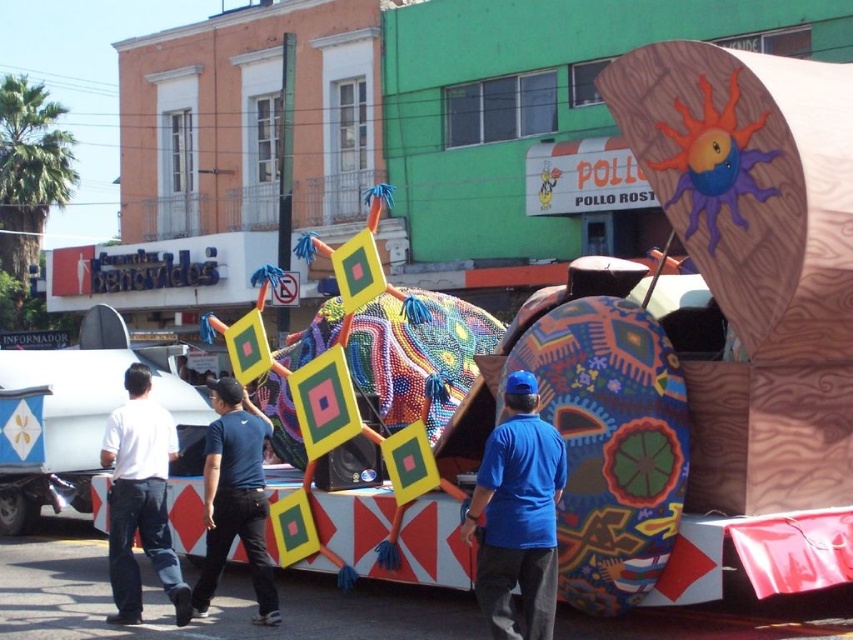
You are standing in front of the float and want to determine which of the two points, point (138, 580) or point (218, 528), is closer to you. Which point is closer?

Point (138, 580) is closer to you because it is further to the viewer than point (218, 528).